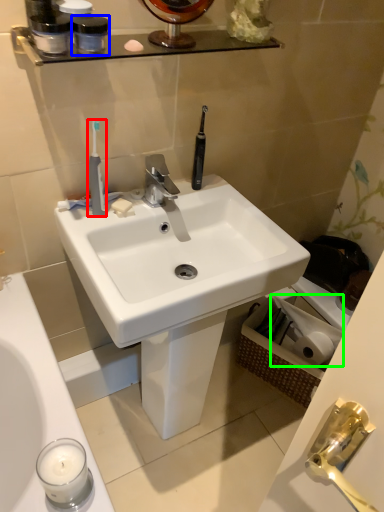
Question: Estimate the real-world distances between objects in this image. Which object is closer to toothbrush (highlighted by a red box), mouthwash (highlighted by a blue box) or toilet paper (highlighted by a green box)?

Choices:
 (A) mouthwash
 (B) toilet paper

Answer: (A)